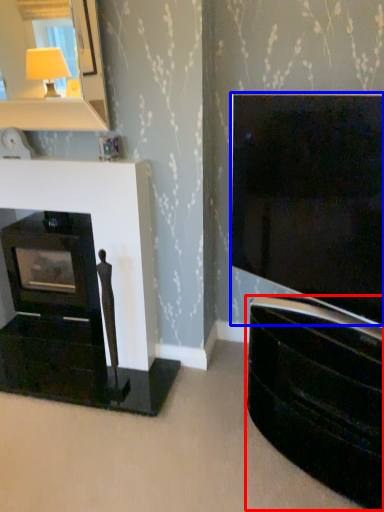
Question: Which object appears closest to the camera in this image, tv cabinet (highlighted by a red box) or television (highlighted by a blue box)?

Choices:
 (A) tv cabinet
 (B) television

Answer: (B)